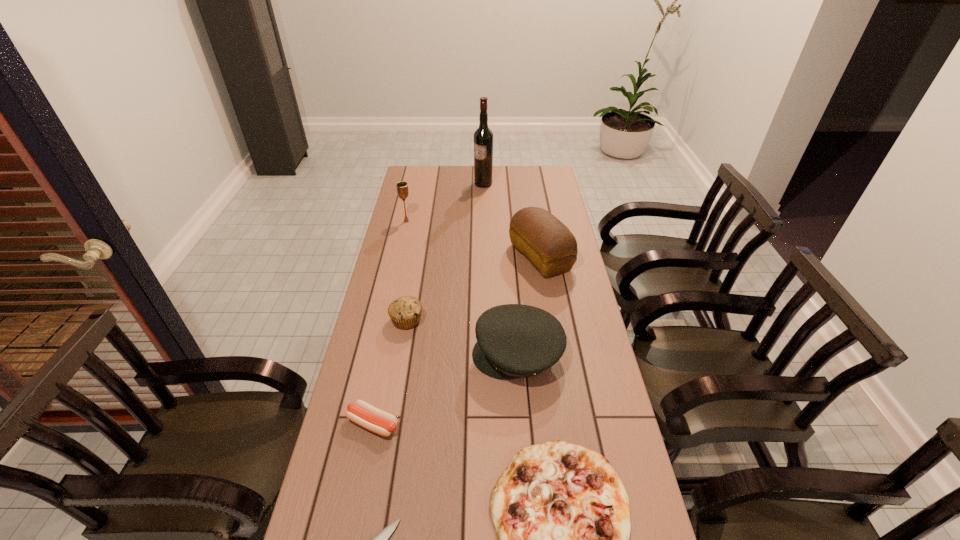
Find the location of a particular element. free location located 0.200m on the right of the chalice is located at coordinates [459, 221].

Find the location of a particular element. free point located on the left of the bread is located at coordinates (489, 257).

Where is `free location located on the front-facing side of the fifth shortest object`? This screenshot has height=540, width=960. free location located on the front-facing side of the fifth shortest object is located at coordinates (410, 354).

The width and height of the screenshot is (960, 540). Identify the location of vacant space located 0.090m on the front-facing side of the fifth shortest object. (443, 354).

At what (x,y) coordinates should I click in order to perform the action: click on free space located 0.240m on the front-facing side of the fifth shortest object. Please return your answer as a coordinate pair (x, y). Looking at the image, I should click on (394, 354).

Where is `free region located on the front of the muffin`? This screenshot has width=960, height=540. free region located on the front of the muffin is located at coordinates (397, 376).

Image resolution: width=960 pixels, height=540 pixels. In order to click on vacant space situated 0.050m on the back of the sixth farthest object in this screenshot , I will do `click(380, 392)`.

Find the location of a particular element. The height and width of the screenshot is (540, 960). object positioned at the far edge is located at coordinates (483, 137).

The image size is (960, 540). I want to click on chalice located in the left edge section of the desktop, so tap(402, 187).

Identify the location of muffin that is positioned at the left edge. The image size is (960, 540). (405, 312).